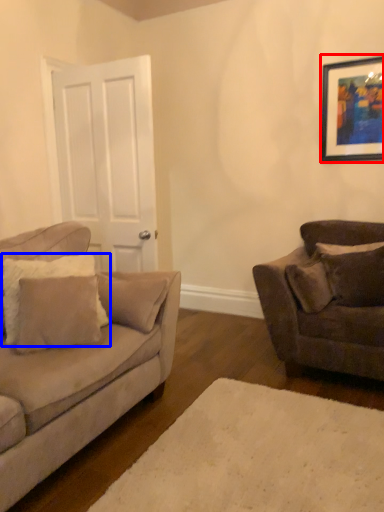
Question: Which object is further to the camera taking this photo, picture frame (highlighted by a red box) or pillow (highlighted by a blue box)?

Choices:
 (A) picture frame
 (B) pillow

Answer: (A)